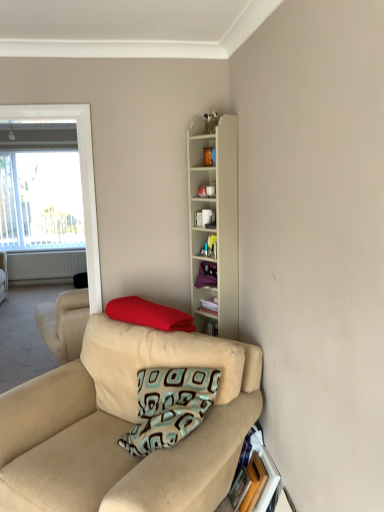
Question: Does wooden picture frame at lower right have a larger size compared to white matte radiator at left?

Choices:
 (A) yes
 (B) no

Answer: (B)

Question: From the image's perspective, is wooden picture frame at lower right under white matte radiator at left?

Choices:
 (A) no
 (B) yes

Answer: (B)

Question: Is wooden picture frame at lower right outside of white matte radiator at left?

Choices:
 (A) yes
 (B) no

Answer: (A)

Question: Does wooden picture frame at lower right turn towards white matte radiator at left?

Choices:
 (A) yes
 (B) no

Answer: (B)

Question: Is wooden picture frame at lower right to the right of white matte radiator at left from the viewer's perspective?

Choices:
 (A) yes
 (B) no

Answer: (A)

Question: Can you confirm if wooden picture frame at lower right is positioned to the left of white matte radiator at left?

Choices:
 (A) no
 (B) yes

Answer: (A)

Question: From the image's perspective, is red fabric pillow at center beneath beige wood cabinet at upper center?

Choices:
 (A) no
 (B) yes

Answer: (B)

Question: Is beige wood cabinet at upper center a part of red fabric pillow at center?

Choices:
 (A) yes
 (B) no

Answer: (B)

Question: Can you confirm if red fabric pillow at center is positioned to the right of beige wood cabinet at upper center?

Choices:
 (A) yes
 (B) no

Answer: (B)

Question: Is red fabric pillow at center wider than beige wood cabinet at upper center?

Choices:
 (A) yes
 (B) no

Answer: (A)

Question: Is red fabric pillow at center outside beige wood cabinet at upper center?

Choices:
 (A) no
 (B) yes

Answer: (B)

Question: Could you tell me if red fabric pillow at center is facing beige wood cabinet at upper center?

Choices:
 (A) yes
 (B) no

Answer: (B)

Question: Is white matte radiator at left oriented towards red fabric pillow at center?

Choices:
 (A) yes
 (B) no

Answer: (A)